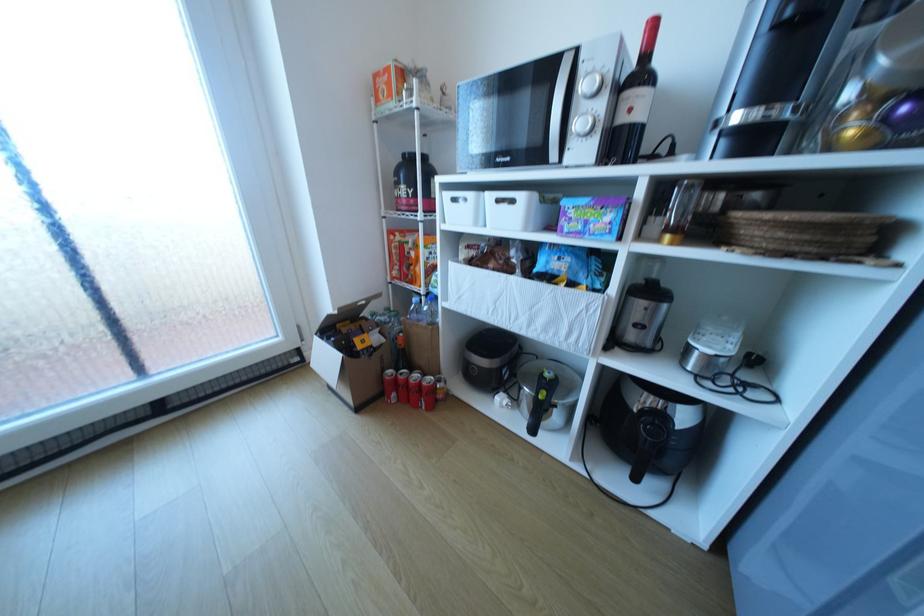
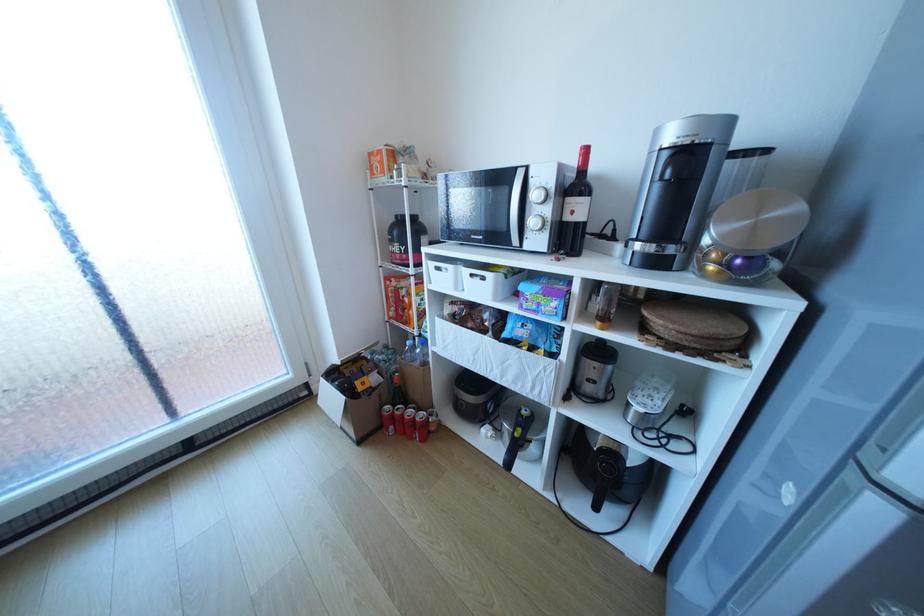
The point at (x=592, y=87) is marked in the first image. Where is the corresponding point in the second image?

(542, 195)